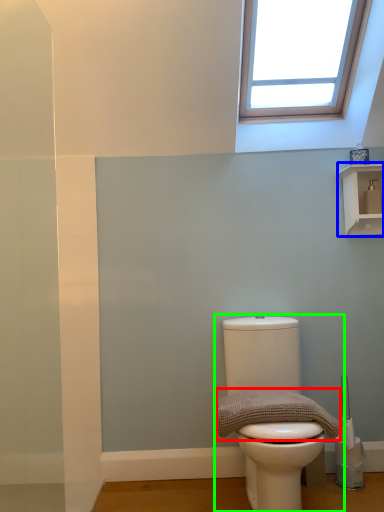
Question: Considering the real-world distances, which object is farthest from material (highlighted by a red box)? shelf (highlighted by a blue box) or toilet (highlighted by a green box)?

Choices:
 (A) shelf
 (B) toilet

Answer: (A)